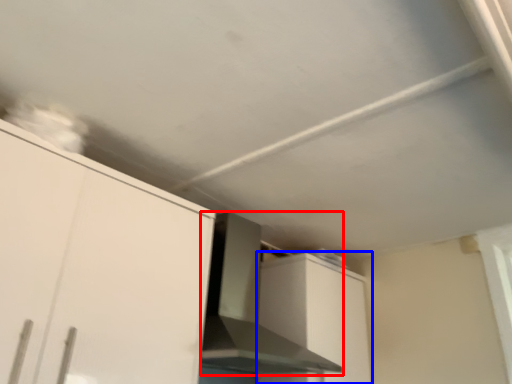
Question: Which object appears farthest to the camera in this image, vent (highlighted by a red box) or cabinetry (highlighted by a blue box)?

Choices:
 (A) vent
 (B) cabinetry

Answer: (B)